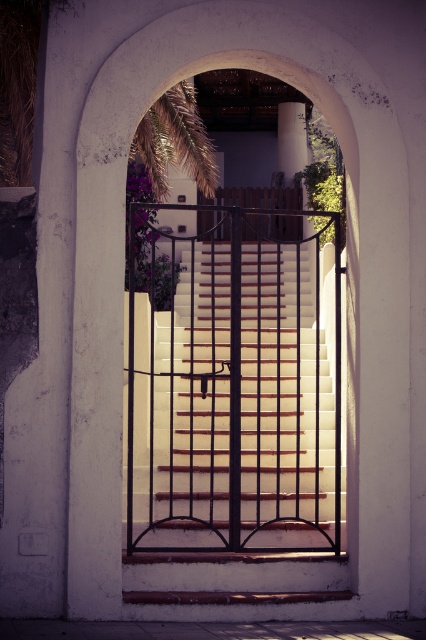
The height and width of the screenshot is (640, 426). Describe the element at coordinates (175, 141) in the screenshot. I see `green leafy palm tree at upper center` at that location.

Does green leafy palm tree at upper center appear under white concrete pillar at upper center?

Yes, green leafy palm tree at upper center is below white concrete pillar at upper center.

At what (x,y) coordinates should I click in order to perform the action: click on green leafy palm tree at upper center. Please return your answer as a coordinate pair (x, y). Looking at the image, I should click on (175, 141).

Who is taller, wooden stairs at center or metallic silver balustrade at center?

Standing taller between the two is wooden stairs at center.

Does wooden stairs at center appear under metallic silver balustrade at center?

Correct, wooden stairs at center is located below metallic silver balustrade at center.

What do you see at coordinates (233, 406) in the screenshot?
I see `wooden stairs at center` at bounding box center [233, 406].

Where is `wooden stairs at center`? The height and width of the screenshot is (640, 426). wooden stairs at center is located at coordinates (233, 406).

Is metallic silver balustrade at center below white concrete pillar at upper center?

Indeed, metallic silver balustrade at center is positioned under white concrete pillar at upper center.

Who is higher up, metallic silver balustrade at center or white concrete pillar at upper center?

white concrete pillar at upper center

Is point (287, 189) positioned in front of point (304, 134)?

Yes.

This screenshot has height=640, width=426. In order to click on metallic silver balustrade at center in this screenshot , I will do `click(256, 196)`.